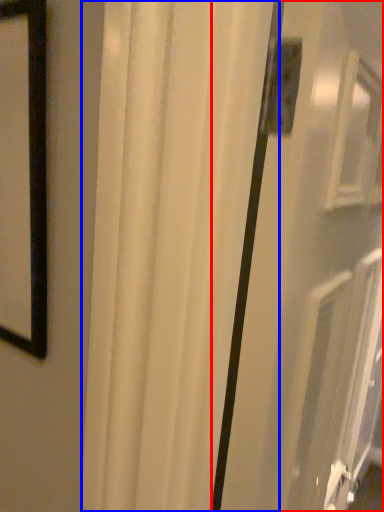
Question: Which of the following is the closest to the observer, screen door (highlighted by a red box) or curtain (highlighted by a blue box)?

Choices:
 (A) screen door
 (B) curtain

Answer: (A)